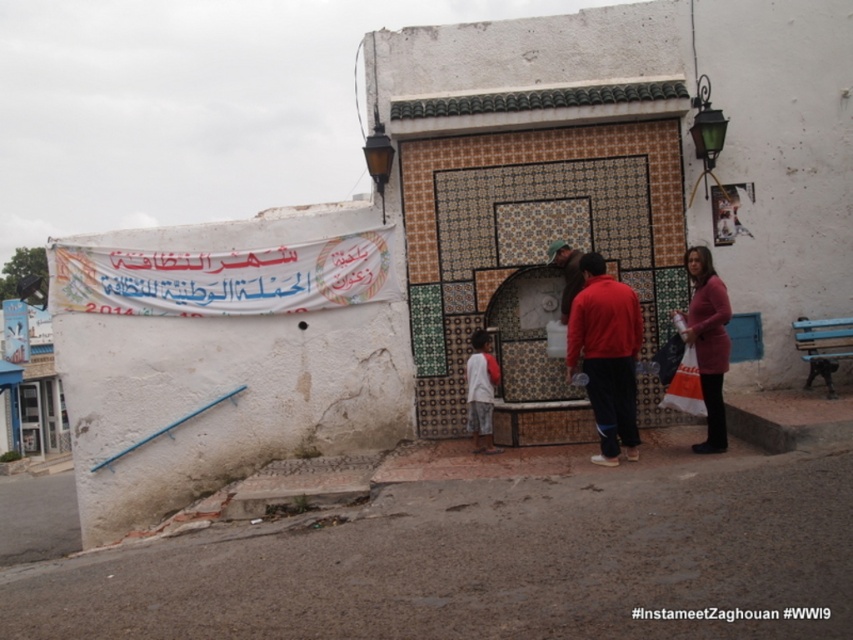
Consider the image. You are a fashion designer observing the image and want to create a layered outfit using the matte red jacket at center and the white cotton shirt at center. Which garment should you place on top to ensure the layered look is visible?

The matte red jacket at center has a greater height compared to the white cotton shirt at center, so placing the matte red jacket at center on top will allow the layered look to be visible.

You are trying to decide which clothing item to take with you from the scene. The pink matte sweater at lower right and the brown leather jacket at center are both available. Based on their sizes, which one would you choose if you need something that covers you more?

The pink matte sweater at lower right has a larger size compared to the brown leather jacket at center, so it would cover you more.